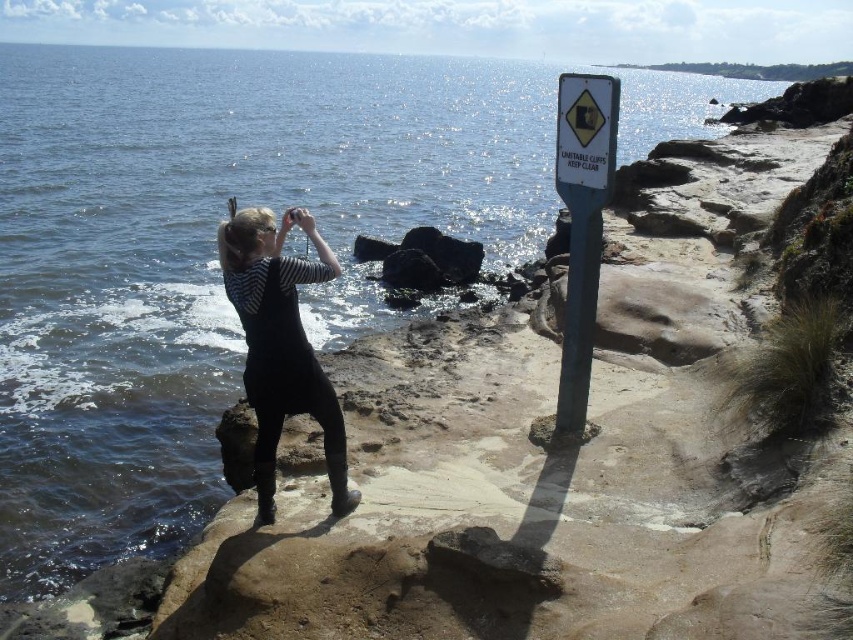
Does blue plastic sign at right have a greater width compared to metallic pole at center-right?

Indeed, blue plastic sign at right has a greater width compared to metallic pole at center-right.

Is blue plastic sign at right bigger than metallic pole at center-right?

Correct, blue plastic sign at right is larger in size than metallic pole at center-right.

Identify the location of blue plastic sign at right. point(582,225).

Is blue plastic sign at right smaller than black matte wetsuit at center?

Actually, blue plastic sign at right might be larger than black matte wetsuit at center.

Does blue plastic sign at right have a greater width compared to black matte wetsuit at center?

Yes.

At what (x,y) coordinates should I click in order to perform the action: click on blue plastic sign at right. Please return your answer as a coordinate pair (x, y). Looking at the image, I should click on (582, 225).

Who is positioned more to the right, black matte wetsuit at center or metallic pole at center-right?

metallic pole at center-right

Between point (276, 289) and point (558, 394), which one is positioned behind?

The point (558, 394) is more distant.

The width and height of the screenshot is (853, 640). Describe the element at coordinates (282, 356) in the screenshot. I see `black matte wetsuit at center` at that location.

This screenshot has width=853, height=640. What are the coordinates of `black matte wetsuit at center` in the screenshot? It's located at (282, 356).